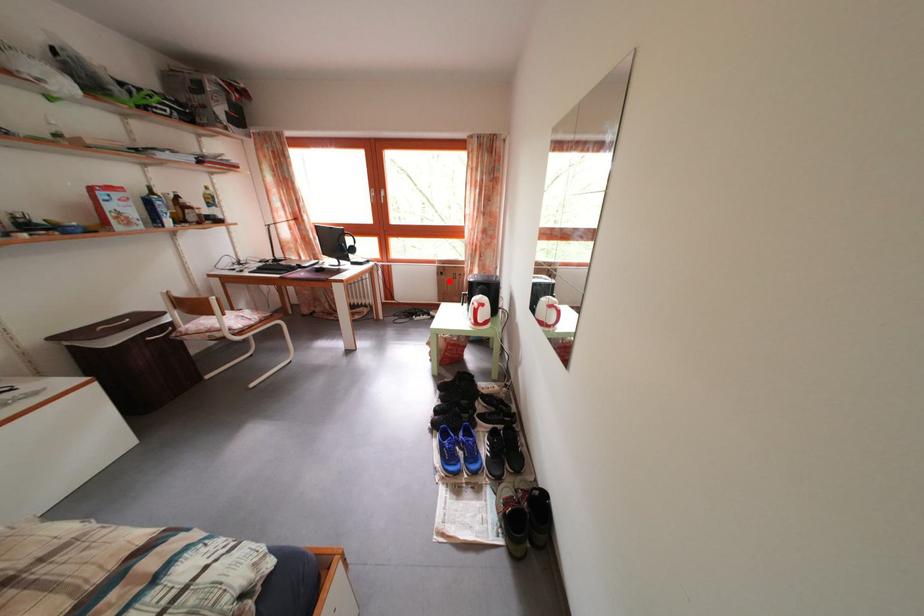
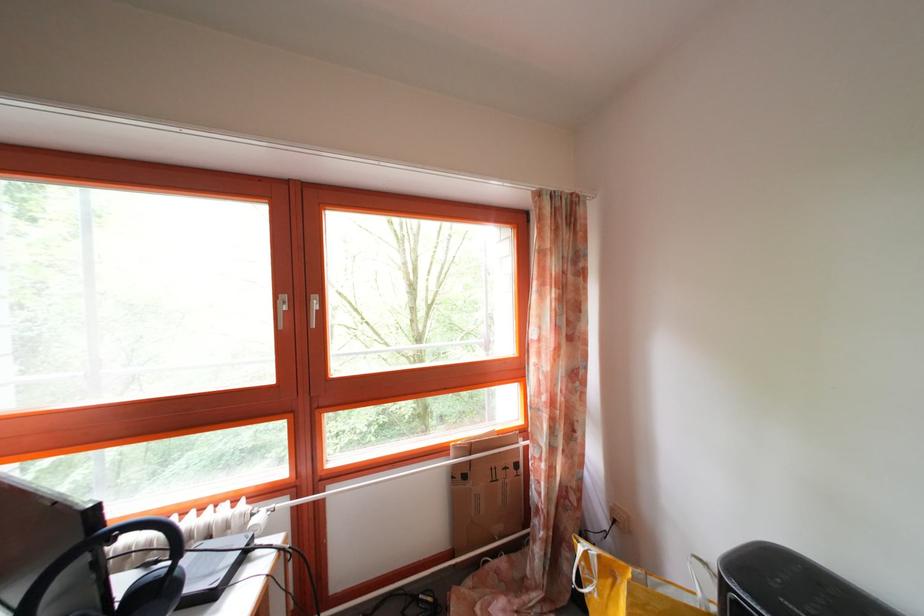
Question: I am providing you with two images of the same scene from different viewpoints. Image1 has a red point marked. In image2, the corresponding 3D location appears at what relative position? Reply with the corresponding letter.

Choices:
 (A) Closer
 (B) Farther

Answer: (B)